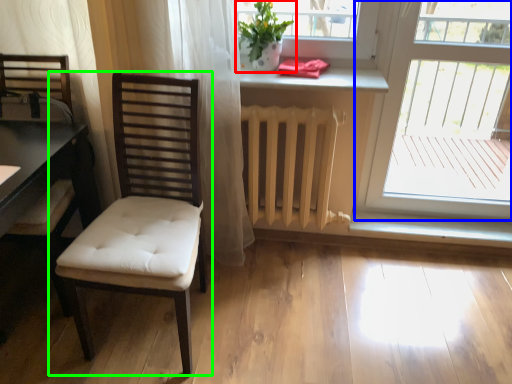
Question: Which object is the closest to the houseplant (highlighted by a red box)? Choose among these: window (highlighted by a blue box) or chair (highlighted by a green box).

Choices:
 (A) window
 (B) chair

Answer: (B)